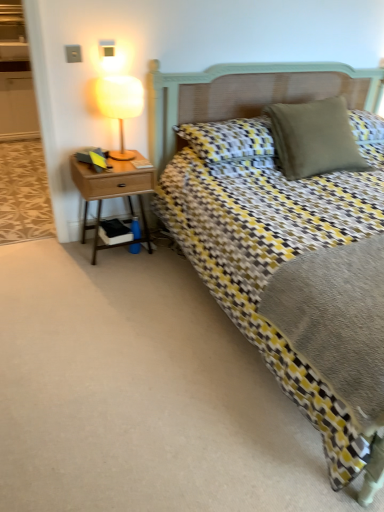
Question: Does matte yellow lampshade at upper left appear on the right side of matte beige pillow at upper right, acting as the 1th pillow starting from the right?

Choices:
 (A) yes
 (B) no

Answer: (B)

Question: Does matte yellow lampshade at upper left have a larger size compared to matte beige pillow at upper right, placed as the second pillow when sorted from left to right?

Choices:
 (A) no
 (B) yes

Answer: (A)

Question: Is matte yellow lampshade at upper left not inside matte beige pillow at upper right, acting as the 1th pillow starting from the right?

Choices:
 (A) yes
 (B) no

Answer: (A)

Question: From a real-world perspective, is matte yellow lampshade at upper left below matte beige pillow at upper right, acting as the 1th pillow starting from the right?

Choices:
 (A) yes
 (B) no

Answer: (B)

Question: Is matte yellow lampshade at upper left turned away from matte beige pillow at upper right, placed as the second pillow when sorted from left to right?

Choices:
 (A) yes
 (B) no

Answer: (B)

Question: From a real-world perspective, relative to textured beige pillow at center, which is the first pillow in left-to-right order, is matte yellow lampshade at upper left vertically above or below?

Choices:
 (A) above
 (B) below

Answer: (A)

Question: Is matte yellow lampshade at upper left in front of or behind textured beige pillow at center, the 2th pillow when ordered from right to left, in the image?

Choices:
 (A) behind
 (B) front

Answer: (B)

Question: Which is correct: matte yellow lampshade at upper left is inside textured beige pillow at center, the 2th pillow when ordered from right to left, or outside of it?

Choices:
 (A) outside
 (B) inside

Answer: (A)

Question: Is point (122, 131) closer or farther from the camera than point (256, 138)?

Choices:
 (A) closer
 (B) farther

Answer: (B)

Question: Is matte yellow lampshade at upper left wider or thinner than matte beige pillow at upper right, placed as the second pillow when sorted from left to right?

Choices:
 (A) thin
 (B) wide

Answer: (A)

Question: Considering the positions of point (107, 95) and point (284, 170), is point (107, 95) closer or farther from the camera than point (284, 170)?

Choices:
 (A) farther
 (B) closer

Answer: (B)

Question: From the image's perspective, is matte yellow lampshade at upper left positioned above or below matte beige pillow at upper right, acting as the 1th pillow starting from the right?

Choices:
 (A) above
 (B) below

Answer: (A)

Question: In the image, is matte yellow lampshade at upper left on the left side or the right side of matte beige pillow at upper right, acting as the 1th pillow starting from the right?

Choices:
 (A) right
 (B) left

Answer: (B)

Question: Based on their sizes in the image, would you say matte yellow lampshade at upper left is bigger or smaller than woodennightstand at left?

Choices:
 (A) small
 (B) big

Answer: (A)

Question: From the image's perspective, is matte yellow lampshade at upper left located above or below woodennightstand at left?

Choices:
 (A) above
 (B) below

Answer: (A)